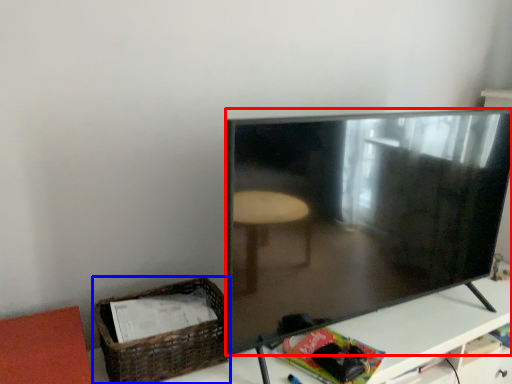
Question: Which object is further to the camera taking this photo, television (highlighted by a red box) or basket (highlighted by a blue box)?

Choices:
 (A) television
 (B) basket

Answer: (B)